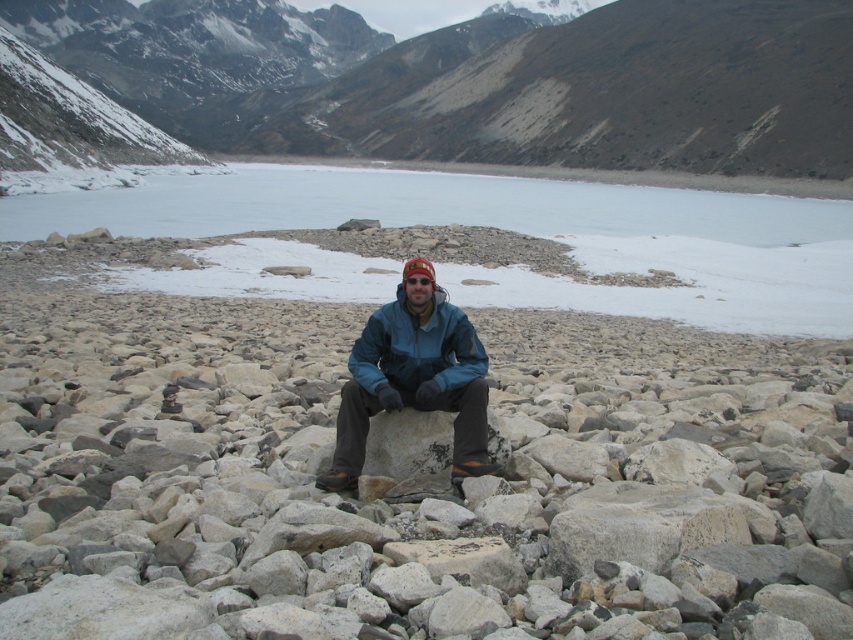
Question: Among these objects, which one is farthest from the camera?

Choices:
 (A) blue fabric jacket at center
 (B) blue matte jacket at center

Answer: (B)

Question: Is brown rocky mountain at upper center above white ice at upper center?

Choices:
 (A) yes
 (B) no

Answer: (A)

Question: Which point is farther to the camera?

Choices:
 (A) white ice at upper center
 (B) blue fabric jacket at center
 (C) blue matte jacket at center

Answer: (A)

Question: Observing the image, what is the correct spatial positioning of white ice at upper center in reference to blue matte jacket at center?

Choices:
 (A) right
 (B) left

Answer: (A)

Question: Which point is farther to the camera?

Choices:
 (A) brown rocky mountain at upper center
 (B) blue matte jacket at center
 (C) white ice at upper center
 (D) blue fabric jacket at center

Answer: (A)

Question: Is brown rocky mountain at upper center below white ice at upper center?

Choices:
 (A) no
 (B) yes

Answer: (A)